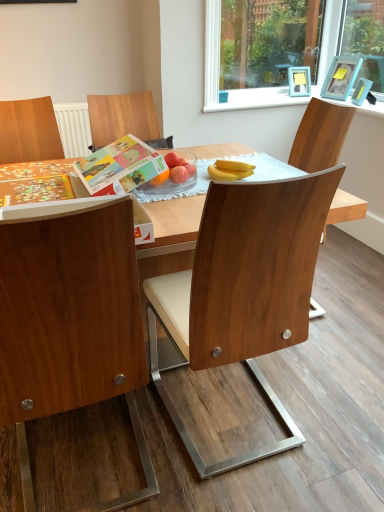
Image resolution: width=384 pixels, height=512 pixels. What are the coordinates of `free space underneath wooden chair at center, the 2th chair when ordered from left to right (from a real-world perspective)` in the screenshot? It's located at (230, 416).